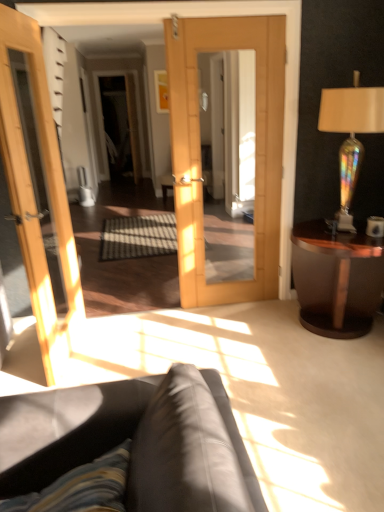
The image size is (384, 512). I want to click on mahogany wood side table at right, so click(x=337, y=278).

Can you confirm if matte white cup at right is smaller than iridescent glass lamp at right?

Correct, matte white cup at right occupies less space than iridescent glass lamp at right.

At what (x,y) coordinates should I click in order to perform the action: click on coffee cup that is under the iridescent glass lamp at right (from a real-world perspective). Please return your answer as a coordinate pair (x, y). Looking at the image, I should click on (375, 226).

Which object is closer to the camera taking this photo, matte white cup at right or iridescent glass lamp at right?

iridescent glass lamp at right.

From the image's perspective, is matte white cup at right over iridescent glass lamp at right?

No.

Considering the sizes of matte white cup at right and leather couch at lower center in the image, is matte white cup at right taller or shorter than leather couch at lower center?

matte white cup at right is shorter than leather couch at lower center.

Can you see matte white cup at right touching leather couch at lower center?

No, matte white cup at right is not next to leather couch at lower center.

Relative to leather couch at lower center, is matte white cup at right in front or behind?

matte white cup at right is behind leather couch at lower center.

Does matte white cup at right contain leather couch at lower center?

No, matte white cup at right does not contain leather couch at lower center.

From the image's perspective, is iridescent glass lamp at right over mahogany wood side table at right?

Indeed, from the image's perspective, iridescent glass lamp at right is shown above mahogany wood side table at right.

Between iridescent glass lamp at right and mahogany wood side table at right, which one appears on the right side from the viewer's perspective?

From the viewer's perspective, iridescent glass lamp at right appears more on the right side.

You are a GUI agent. You are given a task and a screenshot of the screen. Output one action in this format:
    pyautogui.click(x=<x>, y=<y>)
    Task: Click on the lamp lying in front of the mahogany wood side table at right
    Image resolution: width=384 pixels, height=512 pixels.
    Given the screenshot: What is the action you would take?
    pyautogui.click(x=351, y=134)

In the scene shown: Which of these two, iridescent glass lamp at right or mahogany wood side table at right, is wider?

mahogany wood side table at right.

Is leather couch at lower center surrounded by mahogany wood side table at right?

No, leather couch at lower center is not surrounded by mahogany wood side table at right.

From a real-world perspective, is mahogany wood side table at right under leather couch at lower center?

Yes.

Between mahogany wood side table at right and leather couch at lower center, which one has smaller width?

mahogany wood side table at right is thinner.

In the scene shown: Which object is wider, leather couch at lower center or matte white cup at right?

With larger width is leather couch at lower center.

From a real-world perspective, is leather couch at lower center beneath matte white cup at right?

Yes, from a real-world perspective, leather couch at lower center is under matte white cup at right.

In the scene shown: Can you confirm if leather couch at lower center is positioned to the left of matte white cup at right?

Correct, you'll find leather couch at lower center to the left of matte white cup at right.

Does leather couch at lower center appear on the right side of mahogany wood side table at right?

Incorrect, leather couch at lower center is not on the right side of mahogany wood side table at right.

Could you tell me if leather couch at lower center is turned towards mahogany wood side table at right?

No, leather couch at lower center is not aimed at mahogany wood side table at right.

Would you say leather couch at lower center is outside mahogany wood side table at right?

leather couch at lower center is positioned outside mahogany wood side table at right.

Where is `table that is under the leather couch at lower center (from a real-world perspective)`? The width and height of the screenshot is (384, 512). table that is under the leather couch at lower center (from a real-world perspective) is located at coordinates (337, 278).

Between leather couch at lower center and iridescent glass lamp at right, which one has larger size?

Bigger between the two is leather couch at lower center.

Is leather couch at lower center oriented towards iridescent glass lamp at right?

No, leather couch at lower center is not aimed at iridescent glass lamp at right.

Is leather couch at lower center positioned beyond the bounds of iridescent glass lamp at right?

Yes, leather couch at lower center is located beyond the bounds of iridescent glass lamp at right.

Between leather couch at lower center and iridescent glass lamp at right, which one has less height?

→ With less height is leather couch at lower center.

The height and width of the screenshot is (512, 384). Identify the location of coffee cup that appears below the iridescent glass lamp at right (from a real-world perspective). (375, 226).

Where is `studio couch below the matte white cup at right (from the image's perspective)`? This screenshot has height=512, width=384. studio couch below the matte white cup at right (from the image's perspective) is located at coordinates (133, 441).

When comparing their distances from matte white cup at right, does mahogany wood side table at right or iridescent glass lamp at right seem further?

iridescent glass lamp at right lies further to matte white cup at right than the other object.

Which object lies nearer to the anchor point mahogany wood side table at right, iridescent glass lamp at right or leather couch at lower center?

Among the two, iridescent glass lamp at right is located nearer to mahogany wood side table at right.

Which object lies nearer to the anchor point matte white cup at right, iridescent glass lamp at right or leather couch at lower center?

The object closer to matte white cup at right is iridescent glass lamp at right.

When comparing their distances from matte white cup at right, does mahogany wood side table at right or leather couch at lower center seem further?

Based on the image, leather couch at lower center appears to be further to matte white cup at right.

Based on their spatial positions, is leather couch at lower center or mahogany wood side table at right closer to iridescent glass lamp at right?

mahogany wood side table at right is positioned closer to the anchor iridescent glass lamp at right.

Estimate the real-world distances between objects in this image. Which object is closer to mahogany wood side table at right, leather couch at lower center or matte white cup at right?

matte white cup at right is closer to mahogany wood side table at right.

From the image, which object appears to be nearer to leather couch at lower center, iridescent glass lamp at right or matte white cup at right?

matte white cup at right is positioned closer to the anchor leather couch at lower center.

Estimate the real-world distances between objects in this image. Which object is closer to mahogany wood side table at right, iridescent glass lamp at right or matte white cup at right?

matte white cup at right.

Identify the location of table between leather couch at lower center and matte white cup at right in the front-back direction. The height and width of the screenshot is (512, 384). (337, 278).

Identify the location of lamp between leather couch at lower center and matte white cup at right along the z-axis. (351, 134).

Where is `lamp positioned between leather couch at lower center and mahogany wood side table at right from near to far`? The width and height of the screenshot is (384, 512). lamp positioned between leather couch at lower center and mahogany wood side table at right from near to far is located at coordinates (351, 134).

Locate an element on the screen. coffee cup that lies between iridescent glass lamp at right and mahogany wood side table at right from top to bottom is located at coordinates (x=375, y=226).